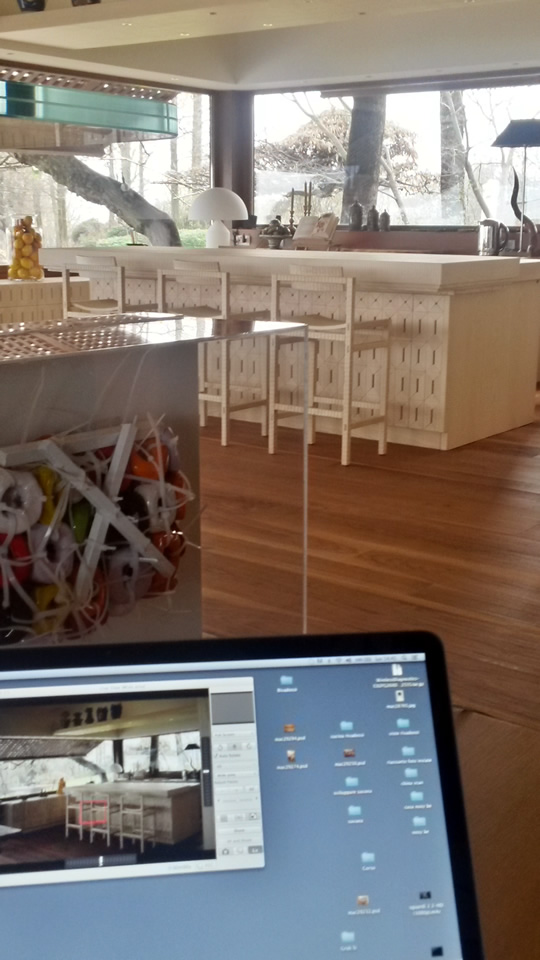
Image resolution: width=540 pixels, height=960 pixels. Find the location of `white roof`. white roof is located at coordinates (308, 13).